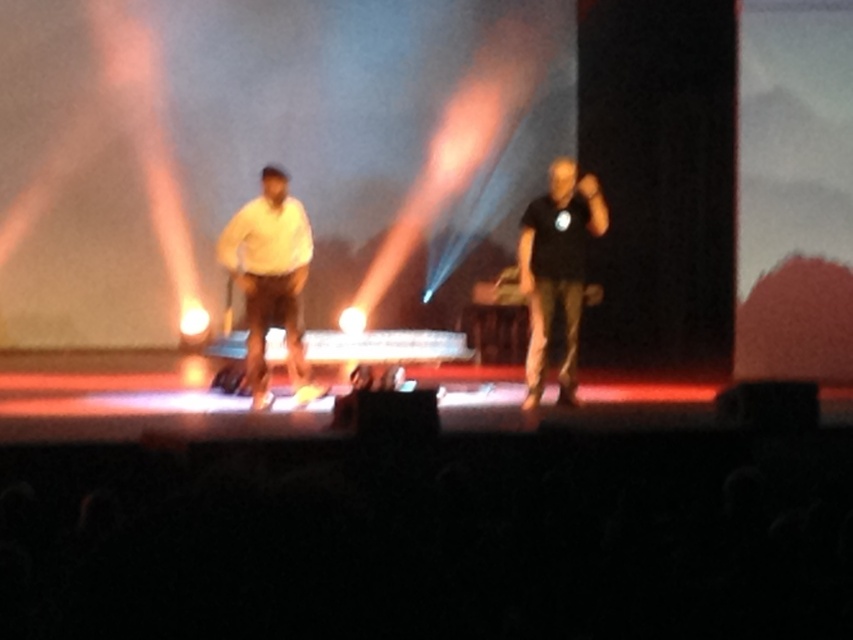
You are a stagehand who needs to adjust the lighting for the performers. You have to ensure that the black matte shirt at center is illuminated as much as the white matte shirt at center. Given their positions, which performer should you focus the light on more to achieve this?

The black matte shirt at center is behind the white matte shirt at center, so you should focus more light on the black matte shirt at center to ensure it receives adequate illumination since it might be in a darker area behind the other performer.

You are a stagehand who needs to place a 2.0 meter long banner between the white matte shirt at center and the black matte shirt at center. Will the banner fit between them without overlapping either shirt?

The distance between the white matte shirt at center and the black matte shirt at center is 2.13 meters. Since the banner is 2.0 meters long, it will fit between them with 0.13 meters of space remaining, so it can be placed without overlapping either shirt.